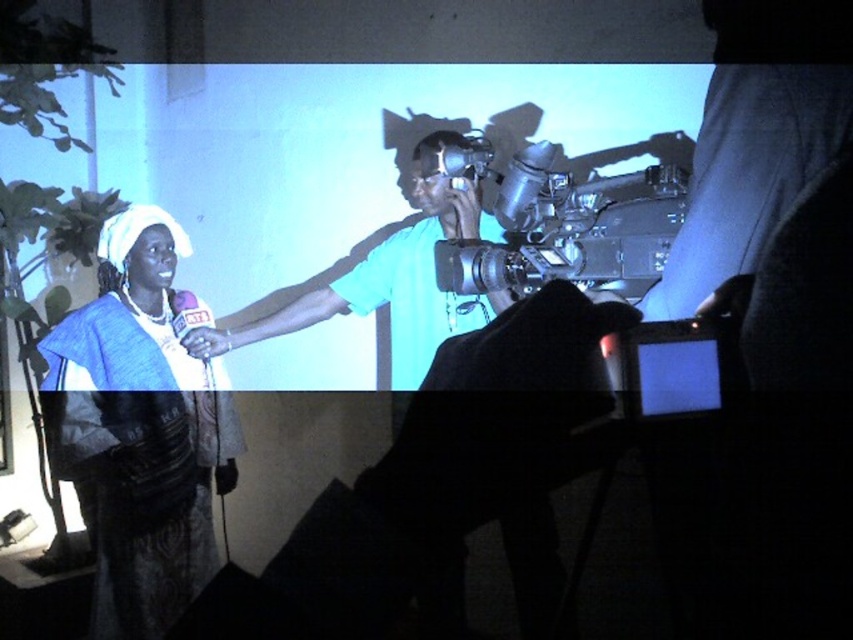
From the picture: Can you confirm if matte blue dress at left is wider than teal matte camera at center?

Incorrect, matte blue dress at left's width does not surpass teal matte camera at center's.

Describe the element at coordinates (140, 429) in the screenshot. I see `matte blue dress at left` at that location.

Locate an element on the screen. This screenshot has width=853, height=640. matte blue dress at left is located at coordinates (140, 429).

Is matte blue dress at left closer to the viewer compared to metallic silver video camera at center?

No, matte blue dress at left is further to the viewer.

Is matte blue dress at left to the right of metallic silver video camera at center from the viewer's perspective?

Incorrect, matte blue dress at left is not on the right side of metallic silver video camera at center.

Where is `matte blue dress at left`? The width and height of the screenshot is (853, 640). matte blue dress at left is located at coordinates (140, 429).

Is metallic silver video camera at center thinner than teal matte camera at center?

Yes.

Is point (584, 227) positioned in front of point (363, 284)?

Yes, it is.

Find the location of a particular element. Image resolution: width=853 pixels, height=640 pixels. metallic silver video camera at center is located at coordinates (560, 224).